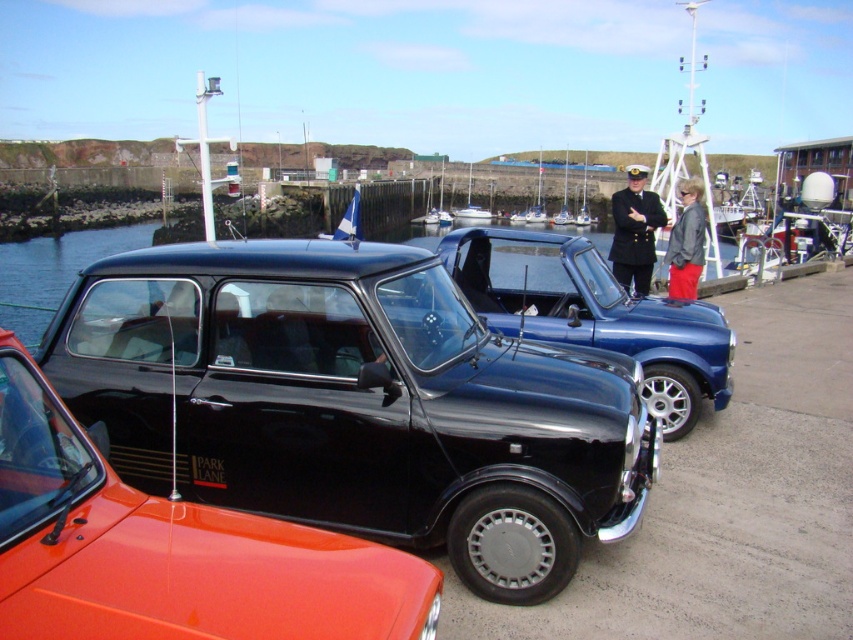
Question: Does glossy blue car at center appear on the left side of dark blue uniform at center?

Choices:
 (A) no
 (B) yes

Answer: (B)

Question: Can you confirm if black glossy car at center is positioned to the left of white glossy boat at center?

Choices:
 (A) no
 (B) yes

Answer: (B)

Question: Does black glossy car at center have a greater width compared to glossy black car at center?

Choices:
 (A) yes
 (B) no

Answer: (A)

Question: Which point is farther to the camera?

Choices:
 (A) click(422, 598)
 (B) click(637, 168)
 (C) click(466, 216)
 (D) click(601, 333)

Answer: (C)

Question: Which of the following is the closest to the observer?

Choices:
 (A) (610, 460)
 (B) (415, 577)

Answer: (B)

Question: Which object is the closest to the glossy black car at center?

Choices:
 (A) white glossy boat at center
 (B) dark blue uniform at center

Answer: (B)